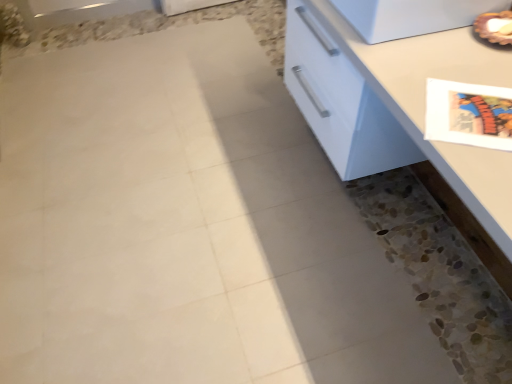
Question: Does point (366, 173) appear closer or farther from the camera than point (371, 4)?

Choices:
 (A) farther
 (B) closer

Answer: (A)

Question: Do you think white glossy countertop at right is within white glossy refrigerator at upper right, or outside of it?

Choices:
 (A) outside
 (B) inside

Answer: (A)

Question: Is white glossy countertop at right bigger or smaller than white glossy refrigerator at upper right?

Choices:
 (A) small
 (B) big

Answer: (B)

Question: Choose the correct answer: Is white glossy refrigerator at upper right inside white glossy countertop at right or outside it?

Choices:
 (A) outside
 (B) inside

Answer: (A)

Question: From the image's perspective, is white glossy refrigerator at upper right located above or below white glossy countertop at right?

Choices:
 (A) above
 (B) below

Answer: (A)

Question: From their relative heights in the image, would you say white glossy refrigerator at upper right is taller or shorter than white glossy countertop at right?

Choices:
 (A) tall
 (B) short

Answer: (B)

Question: Visually, is white glossy refrigerator at upper right positioned to the left or to the right of white glossy countertop at right?

Choices:
 (A) left
 (B) right

Answer: (A)